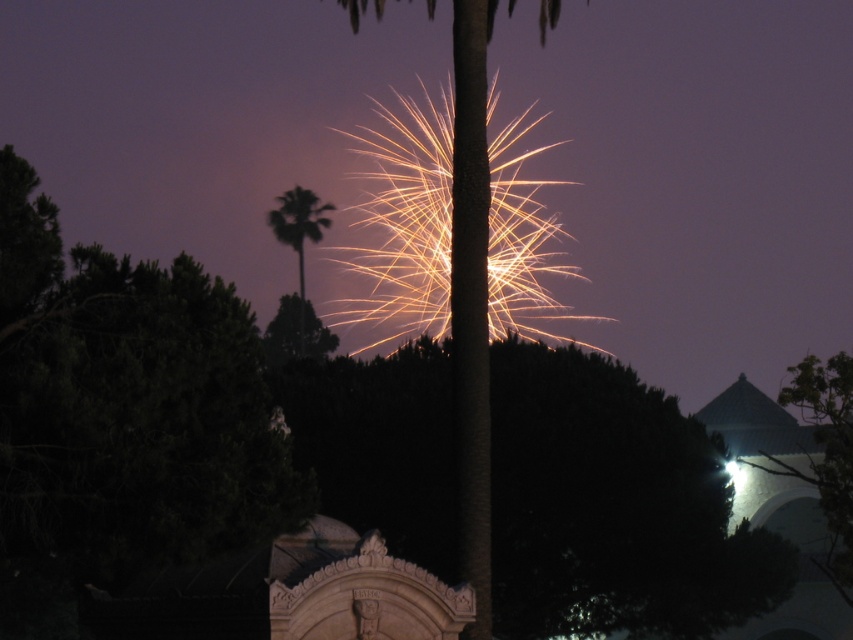
Question: Which of the following is the farthest from the observer?

Choices:
 (A) brown textured palm tree at center
 (B) green leafy palm tree at center

Answer: (B)

Question: Is brown textured palm tree at center thinner than green leafy palm tree at center?

Choices:
 (A) yes
 (B) no

Answer: (B)

Question: Is brown textured palm tree at center smaller than green leafy palm tree at center?

Choices:
 (A) yes
 (B) no

Answer: (B)

Question: Which of the following is the closest to the observer?

Choices:
 (A) (469, 326)
 (B) (322, 212)

Answer: (A)

Question: Does brown textured palm tree at center have a lesser width compared to green leafy palm tree at center?

Choices:
 (A) yes
 (B) no

Answer: (B)

Question: Which of the following is the closest to the observer?

Choices:
 (A) green leafy palm tree at center
 (B) brown textured palm tree at center

Answer: (B)